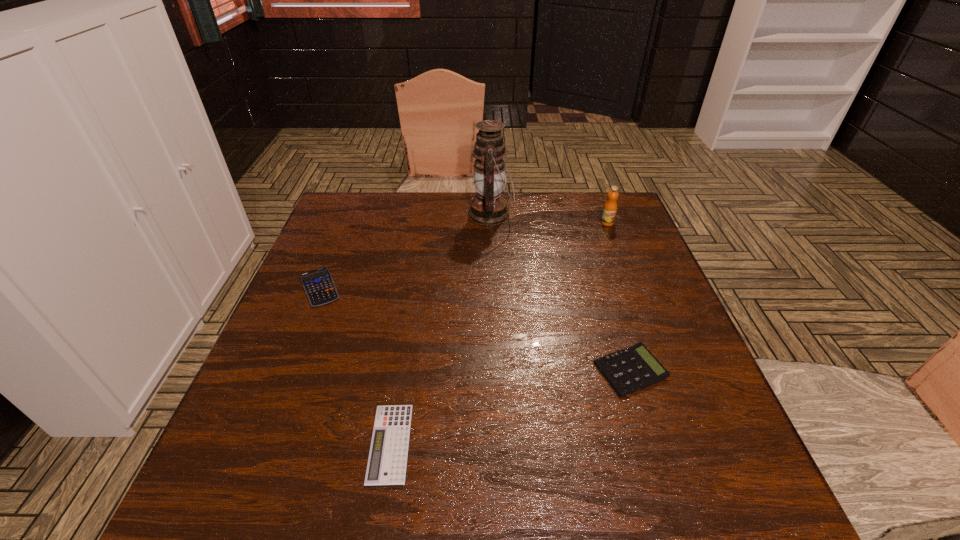
Where is `object that is positioned at the far right corner`? The width and height of the screenshot is (960, 540). object that is positioned at the far right corner is located at coordinates click(609, 211).

The height and width of the screenshot is (540, 960). In order to click on free point at the far edge in this screenshot , I will do point(402,206).

In order to click on free location at the left edge of the desktop in this screenshot , I will do `click(326, 245)`.

Where is `vacant area at the right edge`? This screenshot has width=960, height=540. vacant area at the right edge is located at coordinates (732, 435).

In the image, there is a desktop. What are the coordinates of `vacant space at the far left corner` in the screenshot? It's located at (367, 198).

This screenshot has height=540, width=960. What are the coordinates of `vacant space at the far right corner` in the screenshot? It's located at (621, 206).

At what (x,y) coordinates should I click in order to perform the action: click on empty space that is in between the rightmost calculator and the orange juice. Please return your answer as a coordinate pair (x, y). The image size is (960, 540). Looking at the image, I should click on (618, 296).

I want to click on free space between the rightmost calculator and the lantern, so click(x=561, y=293).

Locate an element on the screen. vacant point located between the lantern and the second object from left to right is located at coordinates (441, 329).

Identify the location of free space between the lantern and the second object from left to right. (441, 329).